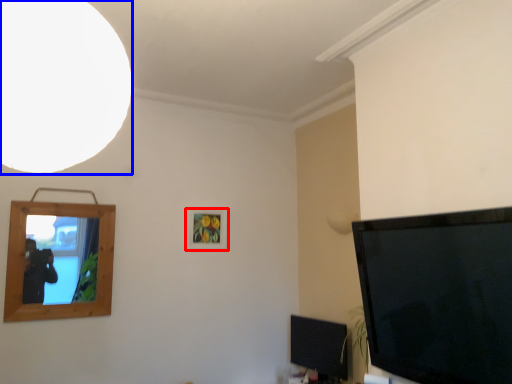
Question: Among these objects, which one is nearest to the camera, picture frame (highlighted by a red box) or light (highlighted by a blue box)?

Choices:
 (A) picture frame
 (B) light

Answer: (B)